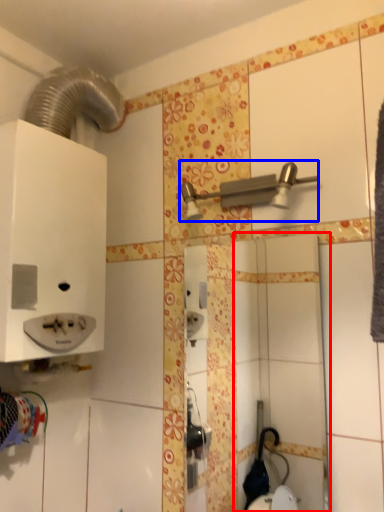
Question: Among these objects, which one is nearest to the camera, mirror (highlighted by a red box) or shower (highlighted by a blue box)?

Choices:
 (A) mirror
 (B) shower

Answer: (B)